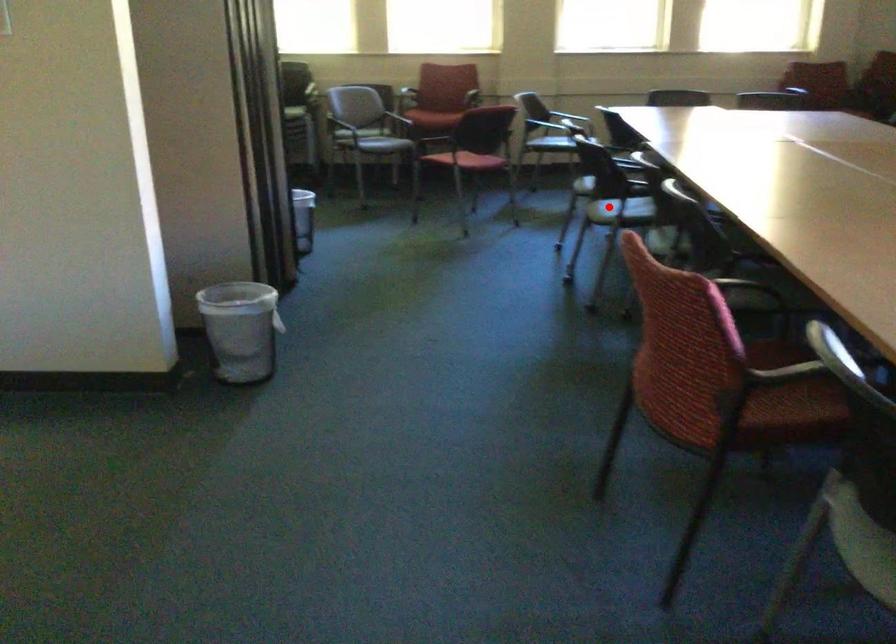
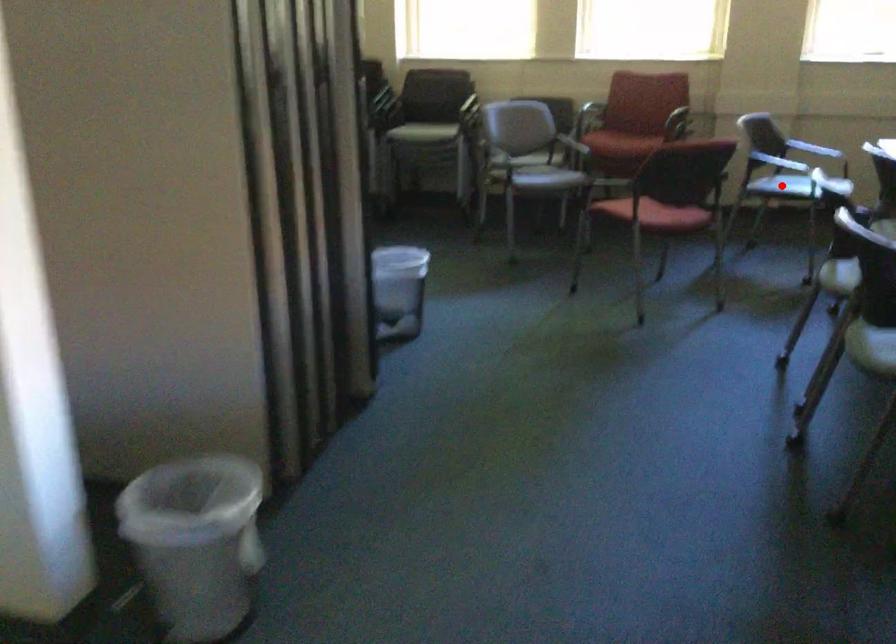
I am providing you with two images of the same scene from different viewpoints. A red point is marked on the first image and another point is marked on the second image. Are the points marked in image1 and image2 representing the same 3D position?

No